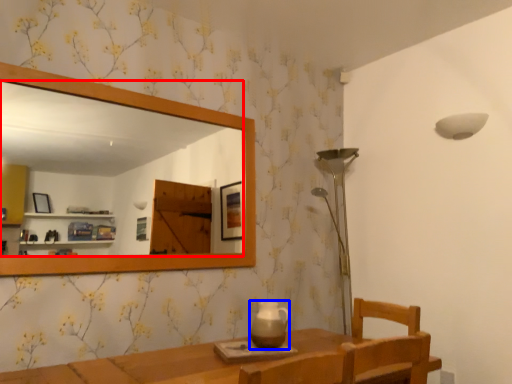
Question: Which object is further to the camera taking this photo, mirror (highlighted by a red box) or tea pot (highlighted by a blue box)?

Choices:
 (A) mirror
 (B) tea pot

Answer: (B)